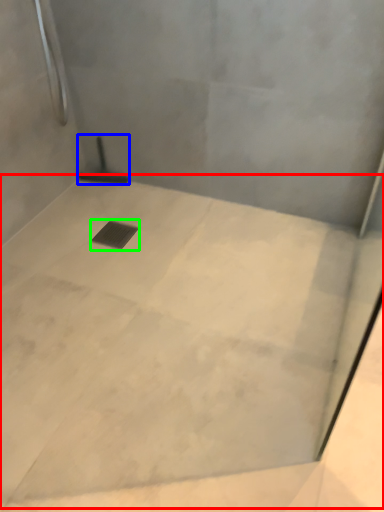
Question: Considering the real-world distances, which object is closest to concrete (highlighted by a red box)? shower (highlighted by a blue box) or drain (highlighted by a green box).

Choices:
 (A) shower
 (B) drain

Answer: (B)